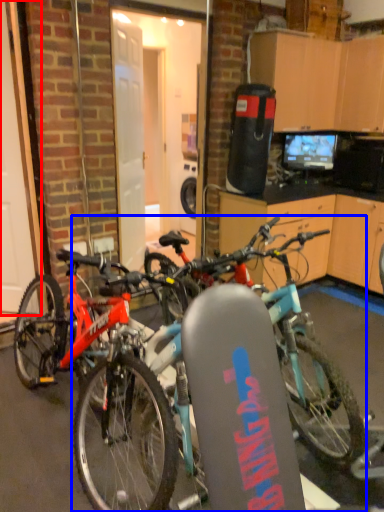
Question: Which of the following is the farthest to the observer, garage door (highlighted by a red box) or bicycle (highlighted by a blue box)?

Choices:
 (A) garage door
 (B) bicycle

Answer: (A)